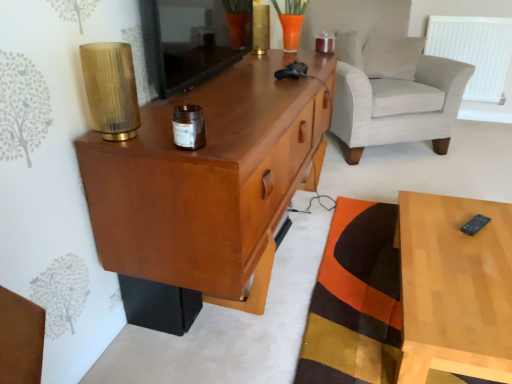
Question: Does white plastic radiator at upper right turn towards white striped fabric armchair at upper right?

Choices:
 (A) yes
 (B) no

Answer: (B)

Question: Considering the relative positions of white plastic radiator at upper right and white striped fabric armchair at upper right in the image provided, is white plastic radiator at upper right behind white striped fabric armchair at upper right?

Choices:
 (A) yes
 (B) no

Answer: (A)

Question: Considering the relative sizes of white plastic radiator at upper right and white striped fabric armchair at upper right in the image provided, is white plastic radiator at upper right wider than white striped fabric armchair at upper right?

Choices:
 (A) no
 (B) yes

Answer: (A)

Question: Considering the relative positions of white plastic radiator at upper right and white striped fabric armchair at upper right in the image provided, is white plastic radiator at upper right to the left of white striped fabric armchair at upper right from the viewer's perspective?

Choices:
 (A) no
 (B) yes

Answer: (A)

Question: Is white plastic radiator at upper right surrounding white striped fabric armchair at upper right?

Choices:
 (A) yes
 (B) no

Answer: (B)

Question: Is translucent bamboo lamp at upper left taller or shorter than matte wood cabinet at left?

Choices:
 (A) short
 (B) tall

Answer: (A)

Question: Considering the positions of translucent bamboo lamp at upper left and matte wood cabinet at left in the image, is translucent bamboo lamp at upper left bigger or smaller than matte wood cabinet at left?

Choices:
 (A) small
 (B) big

Answer: (A)

Question: Is translucent bamboo lamp at upper left inside the boundaries of matte wood cabinet at left, or outside?

Choices:
 (A) outside
 (B) inside

Answer: (A)

Question: From a real-world perspective, is translucent bamboo lamp at upper left above or below matte wood cabinet at left?

Choices:
 (A) below
 (B) above

Answer: (B)

Question: Based on their sizes in the image, would you say white textured pillow at upper right is bigger or smaller than brown glass jar at center, which is counted as the 2th candle holder, starting from the back?

Choices:
 (A) big
 (B) small

Answer: (A)

Question: Is point (394, 46) closer or farther from the camera than point (189, 135)?

Choices:
 (A) closer
 (B) farther

Answer: (B)

Question: Is white textured pillow at upper right wider or thinner than brown glass jar at center, the second candle holder when ordered from top to bottom?

Choices:
 (A) wide
 (B) thin

Answer: (A)

Question: In the image, is white textured pillow at upper right positioned in front of or behind brown glass jar at center, which appears as the first candle holder when viewed from the left?

Choices:
 (A) behind
 (B) front

Answer: (A)

Question: Relative to orange patchwork mat at lower right, is shiny metallic candle at upper center, the 2th candle holder in the bottom-to-top sequence, in front or behind?

Choices:
 (A) behind
 (B) front

Answer: (A)

Question: In terms of height, does shiny metallic candle at upper center, the 2th candle holder in the bottom-to-top sequence, look taller or shorter compared to orange patchwork mat at lower right?

Choices:
 (A) short
 (B) tall

Answer: (B)